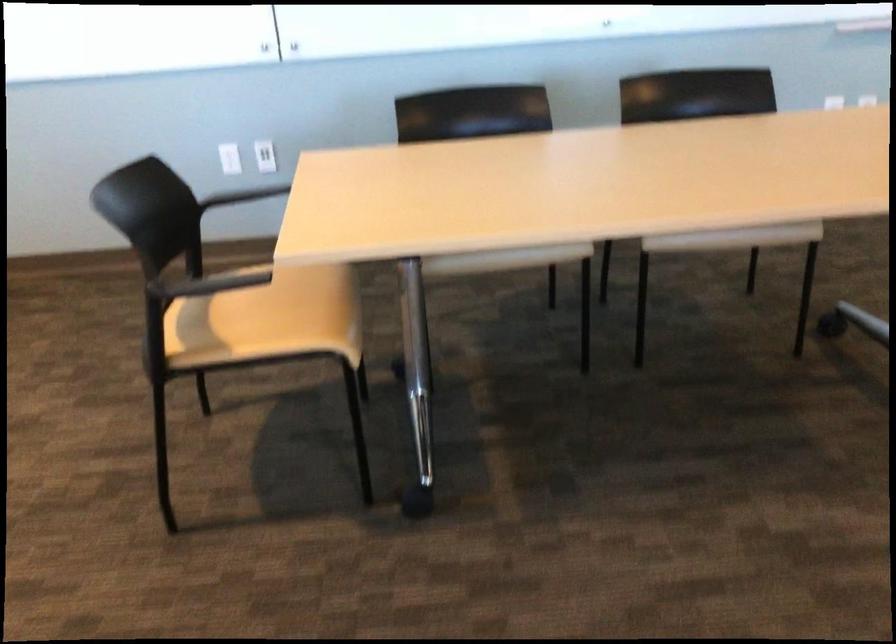
What are the coordinates of `black chair armrest` in the screenshot? It's located at (210, 283).